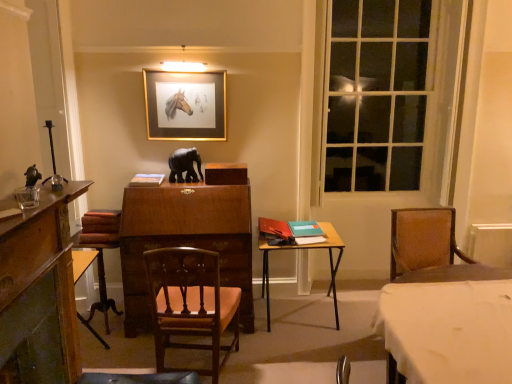
Locate an element on the screen. The image size is (512, 384). free point above matte black elephant at center (from a real-world perspective) is located at coordinates (185, 152).